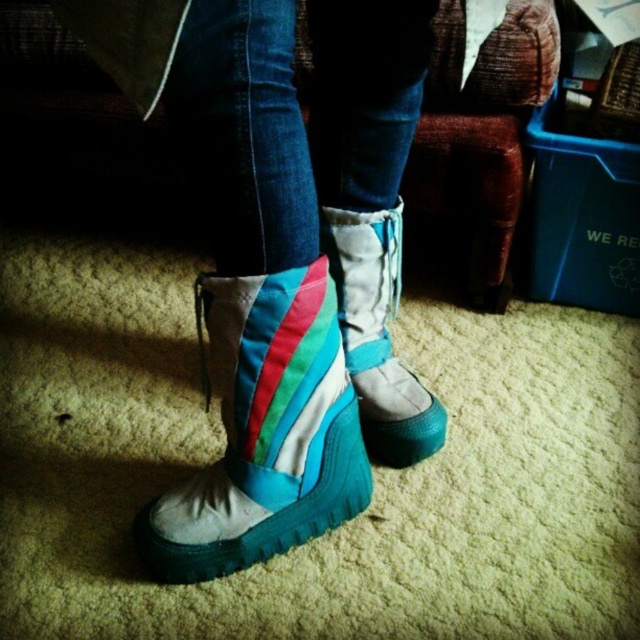
Question: Is teal fabric boots at center to the right of teal fabric boot at lower center from the viewer's perspective?

Choices:
 (A) yes
 (B) no

Answer: (A)

Question: Estimate the real-world distances between objects in this image. Which object is closer to the teal fabric boot at lower center?

Choices:
 (A) teal fabric boots at center
 (B) teal suede boot at center

Answer: (A)

Question: Which point is closer to the camera?

Choices:
 (A) teal fabric boots at center
 (B) teal suede boot at center
 (C) teal fabric boot at lower center

Answer: (A)

Question: Does teal fabric boot at lower center have a greater width compared to teal suede boot at center?

Choices:
 (A) yes
 (B) no

Answer: (A)

Question: Among these points, which one is farthest from the camera?

Choices:
 (A) (346, 260)
 (B) (218, 342)
 (C) (236, 504)

Answer: (A)

Question: Does teal fabric boots at center have a lesser width compared to teal suede boot at center?

Choices:
 (A) no
 (B) yes

Answer: (A)